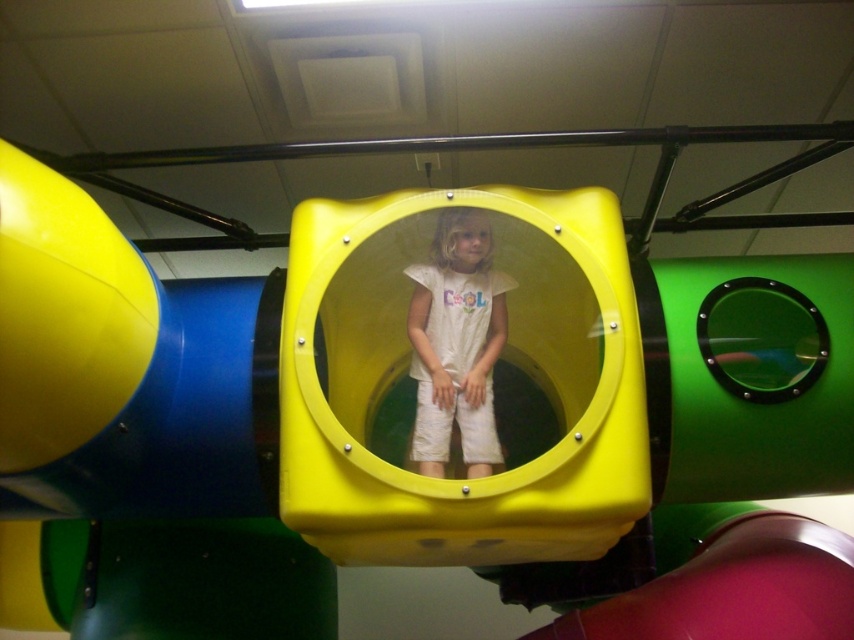
Question: Among these points, which one is farthest from the camera?

Choices:
 (A) (431, 476)
 (B) (817, 563)

Answer: (B)

Question: Is rubberized red slide at lower right below white matte/soft fabric at center?

Choices:
 (A) yes
 (B) no

Answer: (A)

Question: Which of the following is the farthest from the observer?

Choices:
 (A) white matte/soft fabric at center
 (B) rubberized red slide at lower right

Answer: (A)

Question: Does rubberized red slide at lower right have a greater width compared to white matte/soft fabric at center?

Choices:
 (A) yes
 (B) no

Answer: (A)

Question: Does rubberized red slide at lower right have a smaller size compared to white matte/soft fabric at center?

Choices:
 (A) no
 (B) yes

Answer: (A)

Question: Which object appears farthest from the camera in this image?

Choices:
 (A) white matte/soft fabric at center
 (B) rubberized red slide at lower right

Answer: (A)